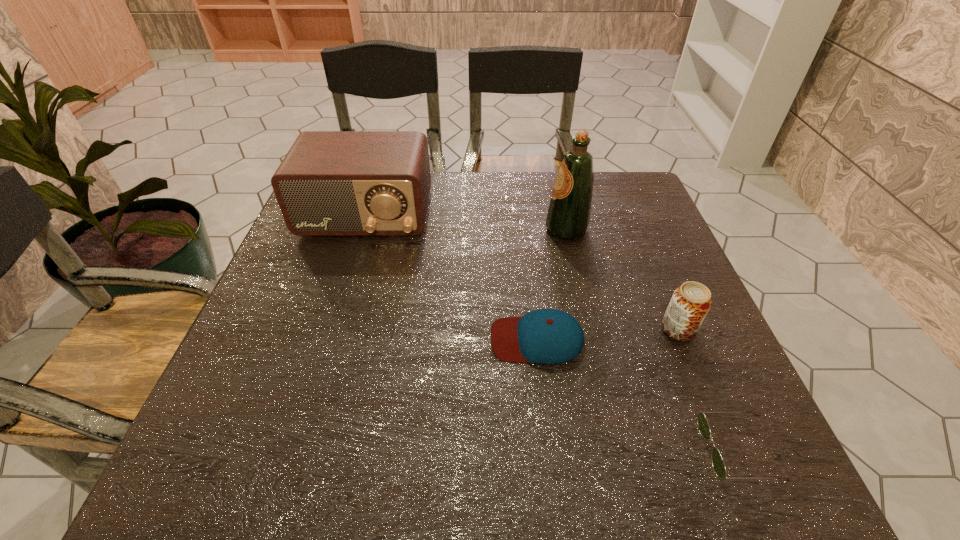
I want to click on vacant space located 0.230m on the front panel of the second tallest object, so click(x=335, y=312).

This screenshot has width=960, height=540. Identify the location of free spot located on the back of the third tallest object. (647, 255).

The height and width of the screenshot is (540, 960). Identify the location of vacant region located 0.220m with the bill of the baseball cap facing forward. (383, 339).

At what (x,y) coordinates should I click in order to perform the action: click on vacant space situated with the bill of the baseball cap facing forward. Please return your answer as a coordinate pair (x, y). The width and height of the screenshot is (960, 540). Looking at the image, I should click on (315, 339).

Locate an element on the screen. free location located with the bill of the baseball cap facing forward is located at coordinates (383, 339).

Where is `free location located on the front-facing side of the sunglasses`? The image size is (960, 540). free location located on the front-facing side of the sunglasses is located at coordinates (472, 450).

You are a GUI agent. You are given a task and a screenshot of the screen. Output one action in this format:
    pyautogui.click(x=<x>, y=<y>)
    Task: Click on the vacant space situated on the front-facing side of the sunglasses
    
    Given the screenshot: What is the action you would take?
    pyautogui.click(x=484, y=450)

Find the location of `free spot located on the front-facing side of the sunglasses`. free spot located on the front-facing side of the sunglasses is located at coordinates (616, 450).

This screenshot has height=540, width=960. I want to click on olive oil at the far edge, so tap(568, 216).

What are the coordinates of `radio receiver that is at the far edge` in the screenshot? It's located at (331, 183).